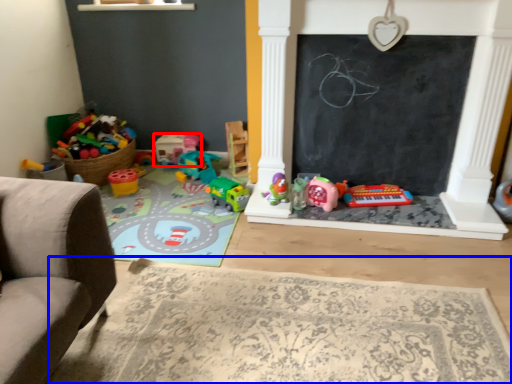
Question: Among these objects, which one is nearest to the camera, toy (highlighted by a red box) or mat (highlighted by a blue box)?

Choices:
 (A) toy
 (B) mat

Answer: (B)